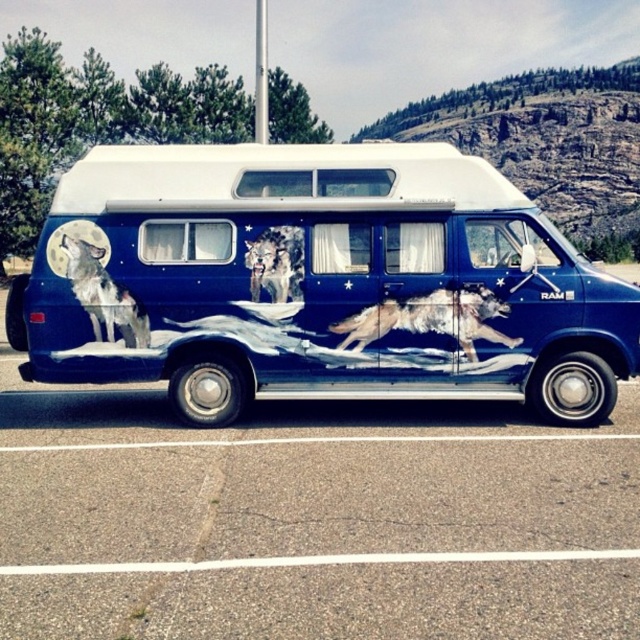
Does point (406, 304) come closer to viewer compared to point (296, 253)?

Yes.

Does shiny silver wolf at center appear on the right side of shiny metallic wolf at center?

Yes, shiny silver wolf at center is to the right of shiny metallic wolf at center.

Is point (438, 301) behind point (259, 269)?

No, it is not.

Where is `shiny silver wolf at center`? shiny silver wolf at center is located at coordinates (429, 320).

Is shiny silver wolf at center taller than gray fur wolf at left?

No, shiny silver wolf at center is not taller than gray fur wolf at left.

The image size is (640, 640). I want to click on shiny silver wolf at center, so click(429, 320).

Can you confirm if blue matte van at center is shorter than shiny silver wolf at center?

No.

This screenshot has height=640, width=640. Identify the location of blue matte van at center. (317, 282).

The width and height of the screenshot is (640, 640). Identify the location of blue matte van at center. (x=317, y=282).